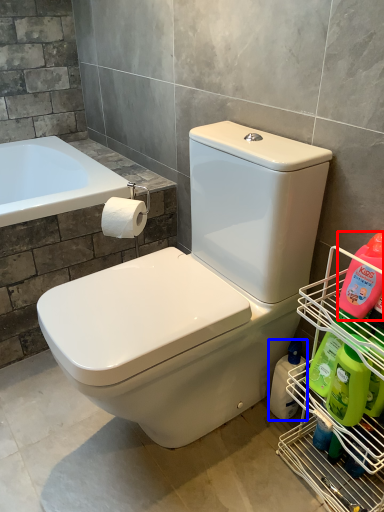
Question: Which point is closer to the camera, cleaning product (highlighted by a red box) or cleaning product (highlighted by a blue box)?

Choices:
 (A) cleaning product
 (B) cleaning product

Answer: (A)